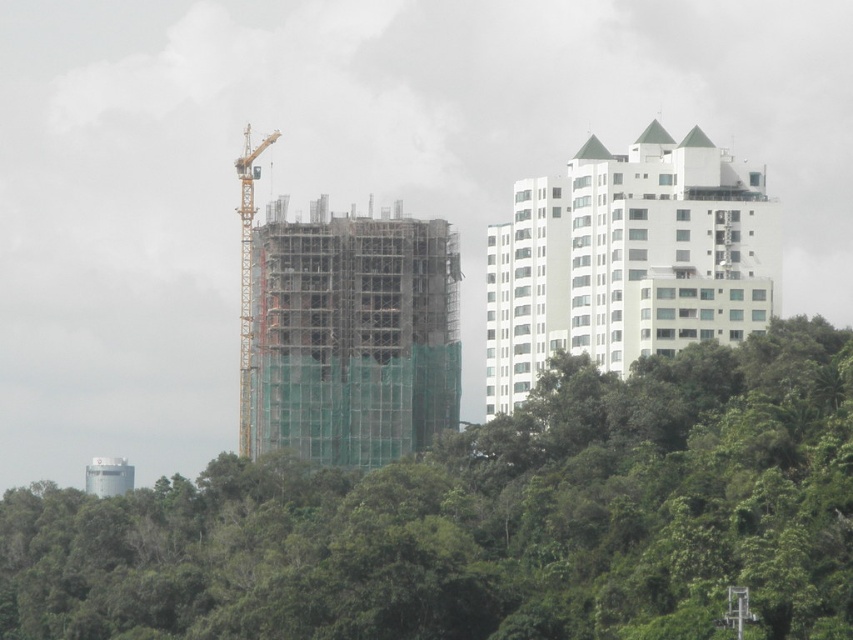
You are a city planner reviewing this urban landscape. You need to determine the spatial relationship between the green leafy trees at center and the two buildings. Based on their positions, which building is closer to the trees?

The green leafy trees at center are located at point [488,520]. Since the trees are at the center, they are equidistant to both the left and right buildings. However, considering the coordinates, the trees are slightly closer to the right building as their x coordinate is 0.814, which is closer to the right side of the image.